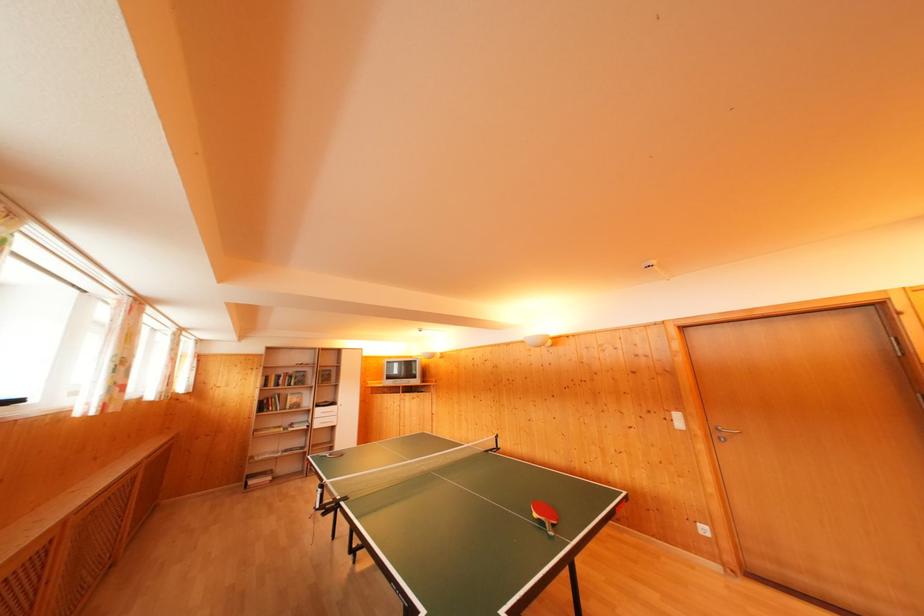
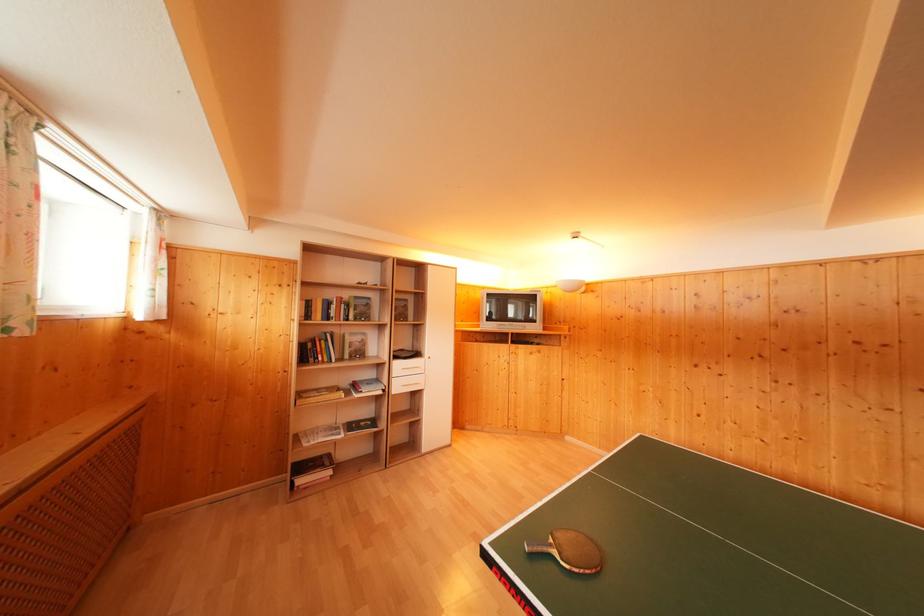
Consider the image. What movement of the cameraman would produce the second image?

The cameraman moved toward left, forward.